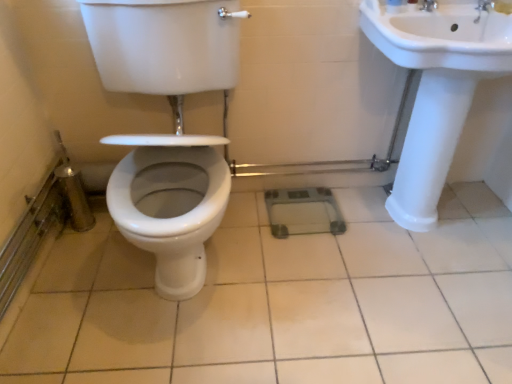
Question: Would you say white glossy tile at center is part of white glossy toilet at center's contents?

Choices:
 (A) no
 (B) yes

Answer: (A)

Question: Is white glossy toilet at center with white glossy tile at center?

Choices:
 (A) no
 (B) yes

Answer: (A)

Question: Is white glossy toilet at center behind white glossy tile at center?

Choices:
 (A) yes
 (B) no

Answer: (B)

Question: From the image's perspective, is white glossy toilet at center located above white glossy tile at center?

Choices:
 (A) yes
 (B) no

Answer: (A)

Question: Does white glossy toilet at center appear on the right side of white glossy tile at center?

Choices:
 (A) no
 (B) yes

Answer: (A)

Question: In terms of size, does white glossy toilet at center appear bigger or smaller than white glossy tile at center?

Choices:
 (A) big
 (B) small

Answer: (A)

Question: From a real-world perspective, is white glossy toilet at center physically located above or below white glossy tile at center?

Choices:
 (A) above
 (B) below

Answer: (A)

Question: From their relative heights in the image, would you say white glossy toilet at center is taller or shorter than white glossy tile at center?

Choices:
 (A) short
 (B) tall

Answer: (B)

Question: From the image's perspective, is white glossy toilet at center positioned above or below white glossy tile at center?

Choices:
 (A) below
 (B) above

Answer: (B)

Question: In terms of width, does white glossy toilet at center look wider or thinner when compared to silver metallic faucet at upper right?

Choices:
 (A) thin
 (B) wide

Answer: (B)

Question: Relative to silver metallic faucet at upper right, is white glossy toilet at center in front or behind?

Choices:
 (A) behind
 (B) front

Answer: (B)

Question: Considering the relative positions of white glossy toilet at center and silver metallic faucet at upper right in the image provided, is white glossy toilet at center to the left or to the right of silver metallic faucet at upper right?

Choices:
 (A) right
 (B) left

Answer: (B)

Question: Is white glossy toilet at center spatially inside silver metallic faucet at upper right, or outside of it?

Choices:
 (A) outside
 (B) inside

Answer: (A)

Question: From a real-world perspective, relative to silver metallic faucet at upper right, is white glossy tile at center vertically above or below?

Choices:
 (A) above
 (B) below

Answer: (B)

Question: Based on their sizes in the image, would you say white glossy tile at center is bigger or smaller than silver metallic faucet at upper right?

Choices:
 (A) small
 (B) big

Answer: (B)